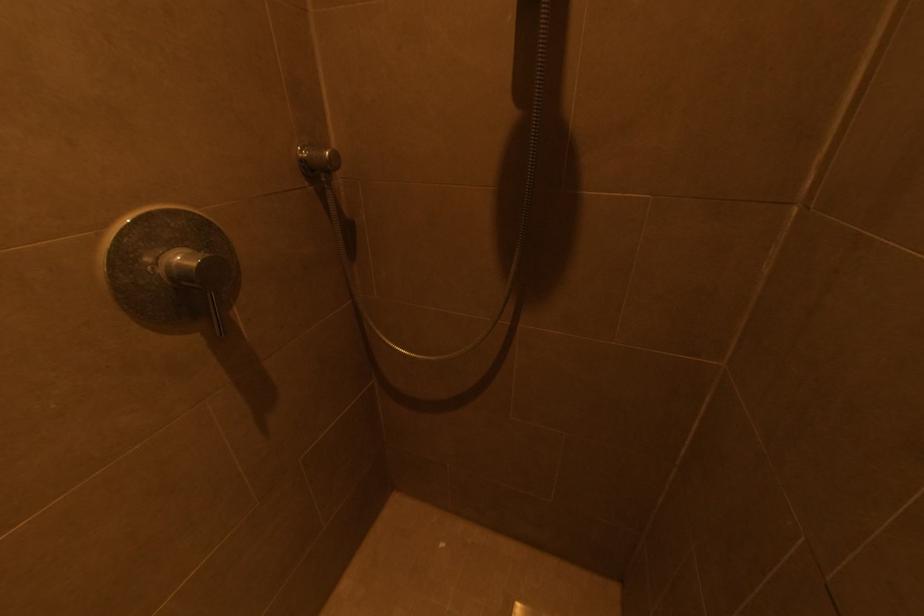
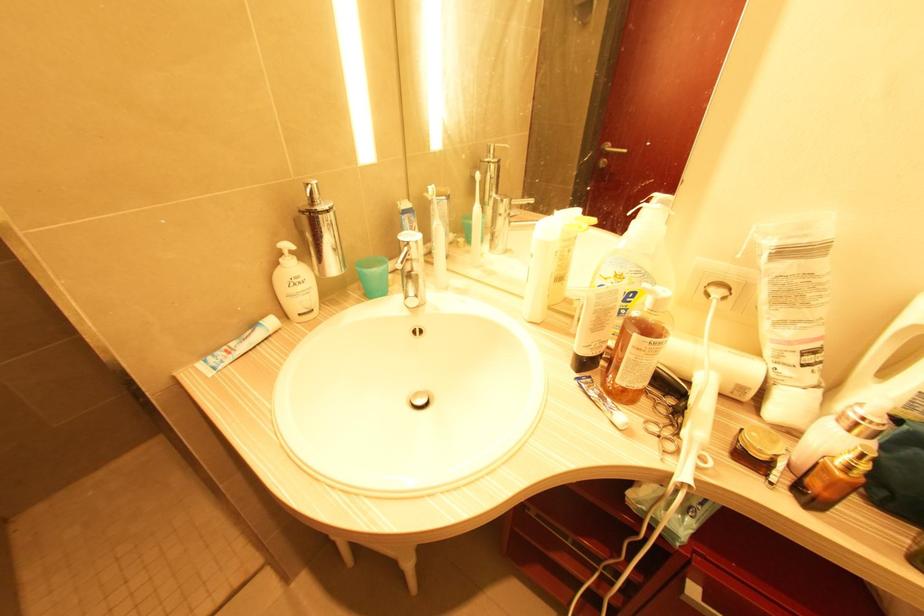
Question: In a continuous first-person perspective shot, in which direction is the camera moving?

Choices:
 (A) Left
 (B) Right
 (C) Forward
 (D) Backward

Answer: (B)